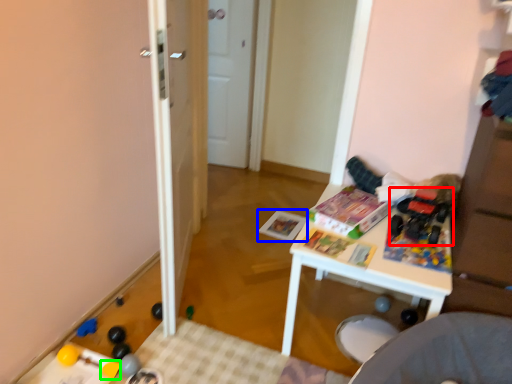
Question: Considering the real-world distances, which object is farthest from toy (highlighted by a red box)? magazine (highlighted by a blue box) or toy (highlighted by a green box)?

Choices:
 (A) magazine
 (B) toy

Answer: (B)